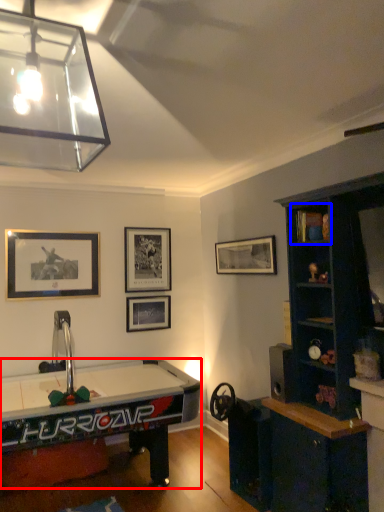
Question: Which point is further to the camera, desk (highlighted by a red box) or cabinet (highlighted by a blue box)?

Choices:
 (A) desk
 (B) cabinet

Answer: (B)